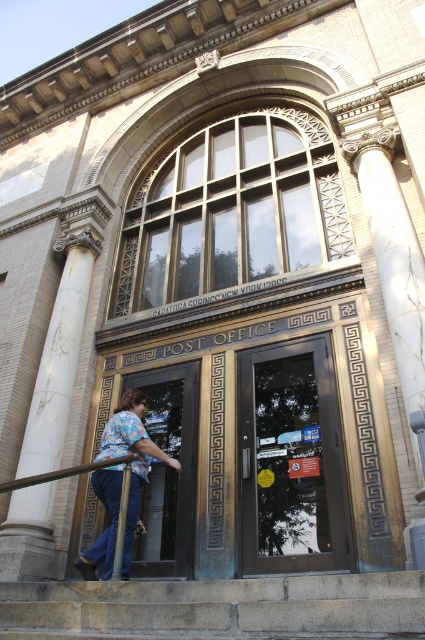
Does matte glass door at center have a lesser width compared to blue jeans at lower left?

Yes.

You are a GUI agent. You are given a task and a screenshot of the screen. Output one action in this format:
    pyautogui.click(x=<x>, y=<y>)
    Task: Click on the matte glass door at center
    Image resolution: width=425 pixels, height=640 pixels.
    Given the screenshot: What is the action you would take?
    pos(169,470)

Describe the element at coordinates (169, 470) in the screenshot. I see `matte glass door at center` at that location.

Where is `matte glass door at center`? Image resolution: width=425 pixels, height=640 pixels. matte glass door at center is located at coordinates (169, 470).

Is point (283, 556) closer to camera compared to point (192, 545)?

Yes, point (283, 556) is closer to viewer.

Which is in front, point (345, 481) or point (142, 556)?

Point (345, 481) is more forward.

Identify the location of shiny dark glass door at center. (291, 460).

Is shiny dark glass door at center in front of blue jeans at lower left?

That is False.

Between point (248, 392) and point (125, 417), which one is positioned in front?

Point (125, 417)

Describe the element at coordinates (291, 460) in the screenshot. I see `shiny dark glass door at center` at that location.

In order to click on shiny dark glass door at center in this screenshot , I will do `click(291, 460)`.